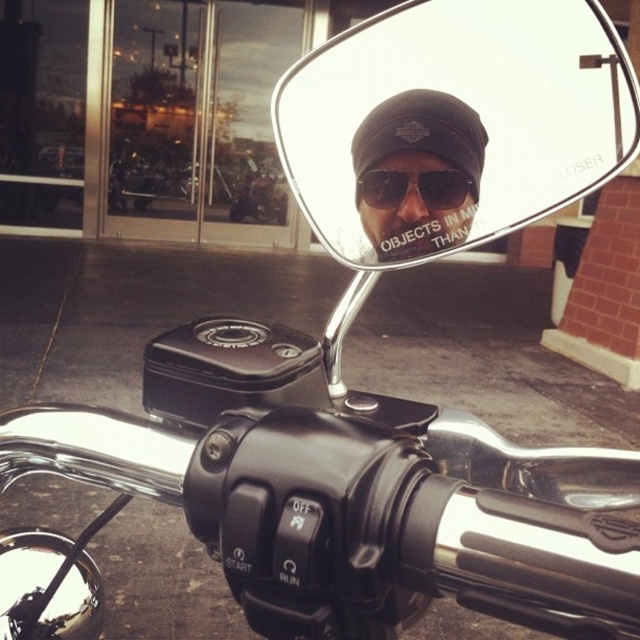
You are a motorcycle rider checking your side mirror reflection. You notice two items on your head and face. Which item in your reflection appears larger, the matte black cap at center or the black matte sunglasses at center?

The matte black cap at center appears larger in the reflection because it is closer to the viewer than the black matte sunglasses at center, and objects closer to a mirror appear larger.

You are a motorcycle rider checking your mirrors before starting the ride. You notice the black reflective mirror at upper center and the matte black cap at center. Which object is nearer to you as you sit on the motorcycle?

The black reflective mirror at upper center is closer to the viewer than the matte black cap at center, so the black reflective mirror at upper center is nearer to you as you sit on the motorcycle.